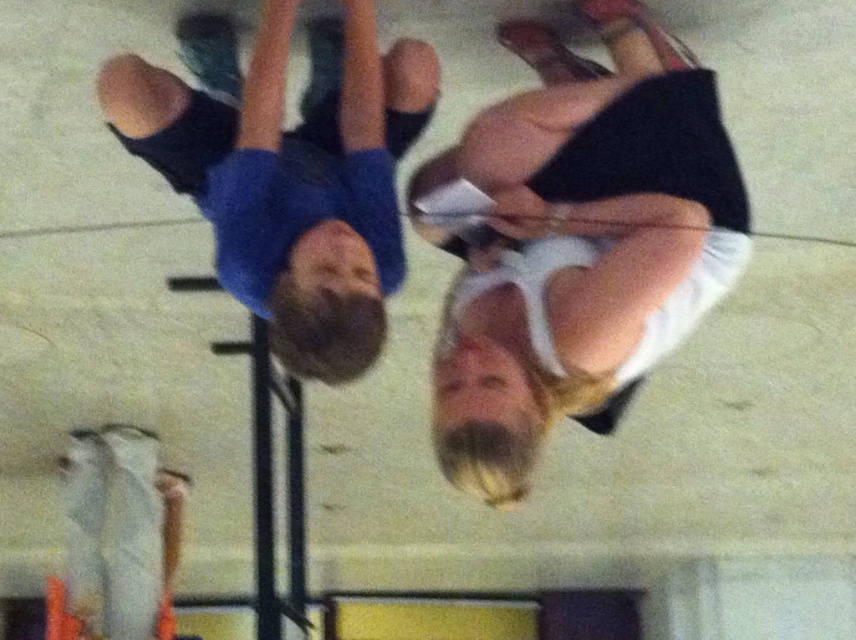
Question: Which of the following is the farthest from the observer?

Choices:
 (A) (480, 300)
 (B) (266, 144)

Answer: (B)

Question: Is white matte skirt at center smaller than blue cotton shirt at upper left?

Choices:
 (A) no
 (B) yes

Answer: (A)

Question: Where is white matte skirt at center located in relation to blue cotton shirt at upper left in the image?

Choices:
 (A) left
 (B) right

Answer: (B)

Question: Is white matte skirt at center thinner than blue cotton shirt at upper left?

Choices:
 (A) yes
 (B) no

Answer: (A)